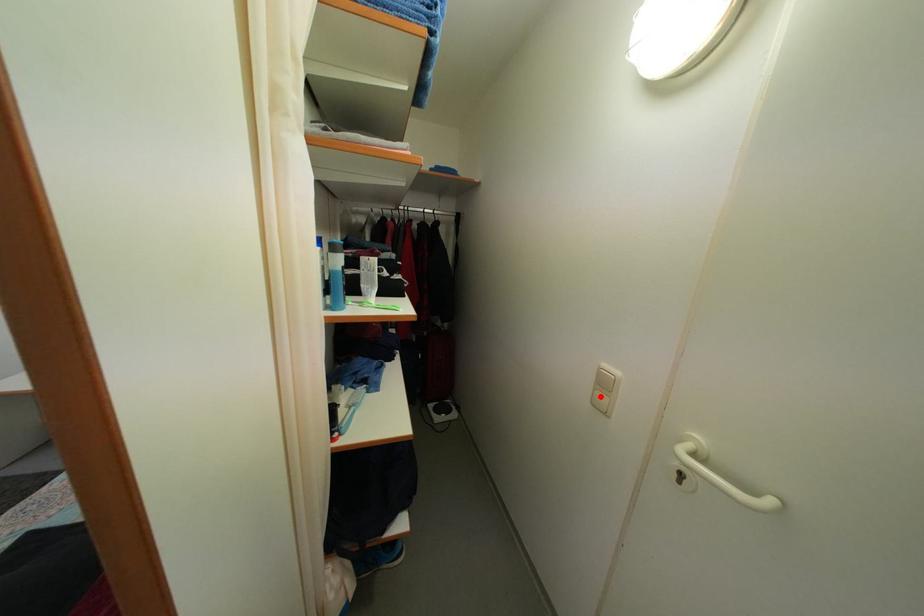
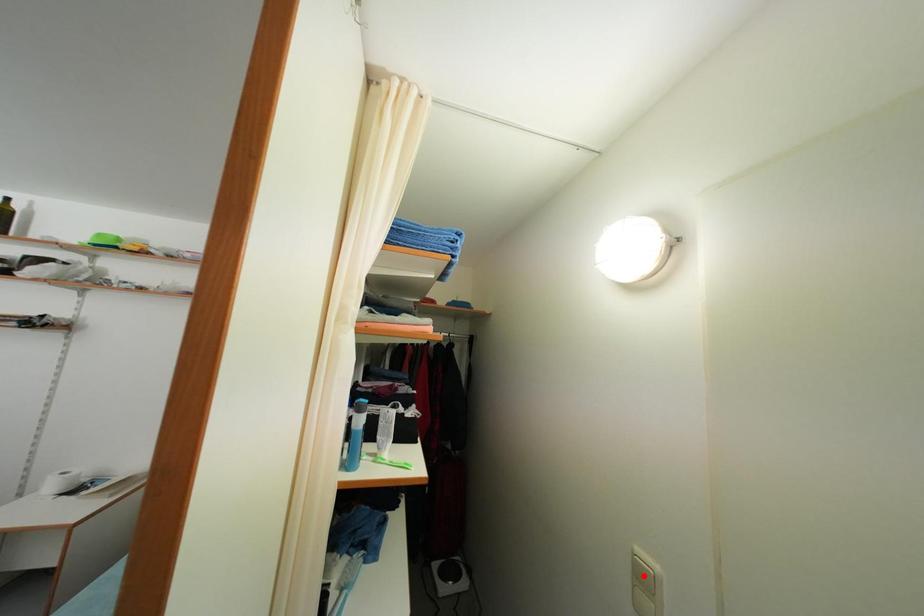
I am providing you with two images of the same scene from different viewpoints. A red point is marked on the first image and another point is marked on the second image. Do the highlighted points in image1 and image2 indicate the same real-world spot?

No